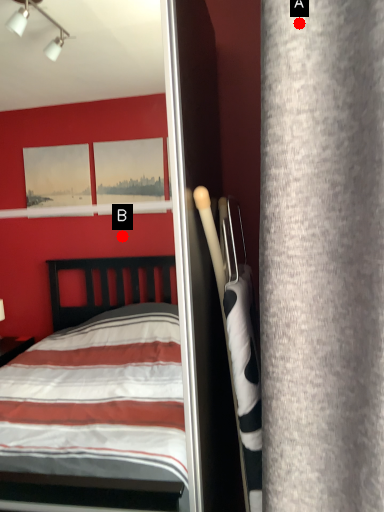
Question: Two points are circled on the image, labeled by A and B beside each circle. Which point is closer to the camera taking this photo?

Choices:
 (A) A is closer
 (B) B is closer

Answer: (A)